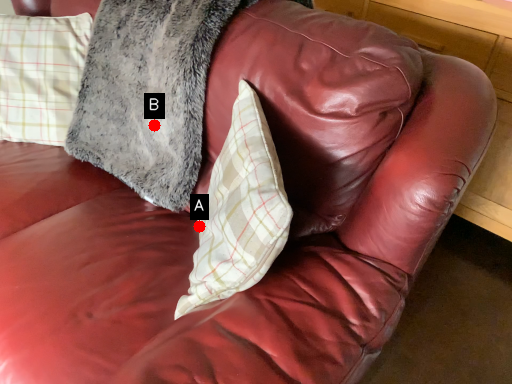
Question: Two points are circled on the image, labeled by A and B beside each circle. Which of the following is the closest to the observer?

Choices:
 (A) A is closer
 (B) B is closer

Answer: (A)